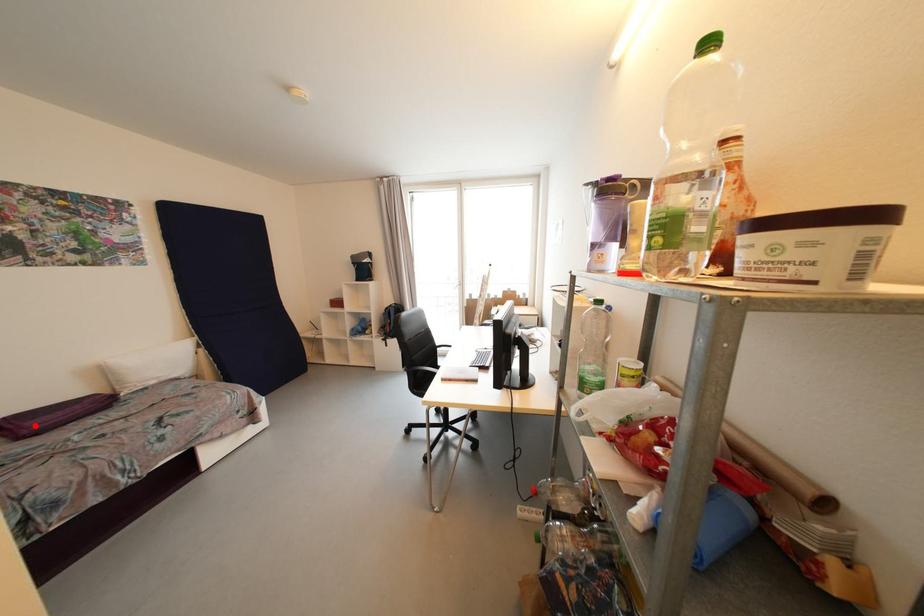
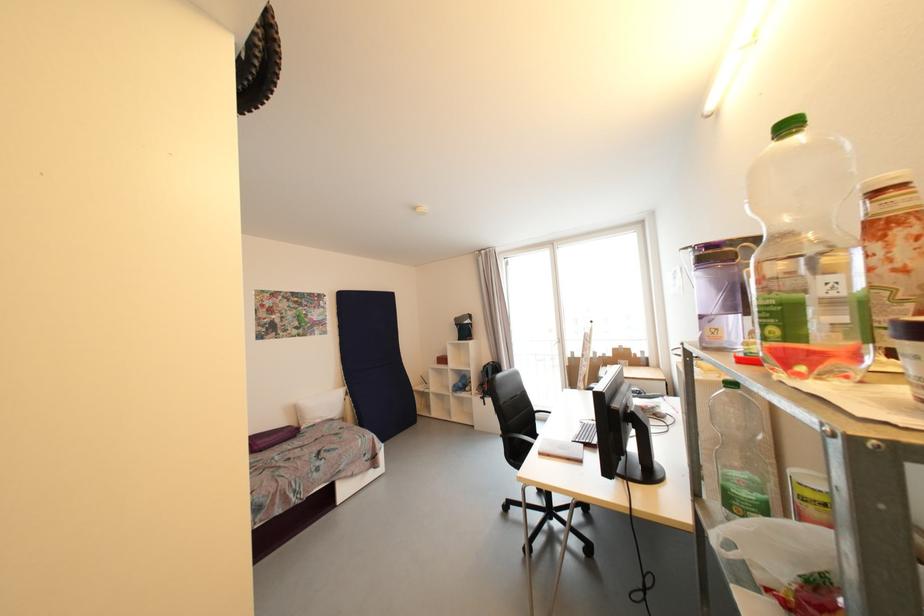
Find the pixel in the second image that matches the highlighted location in the first image.

(263, 445)